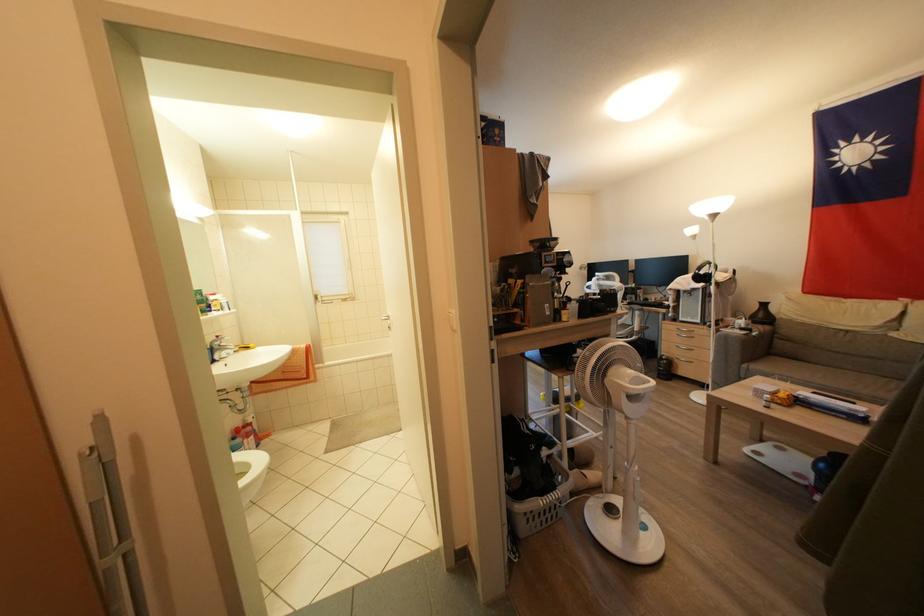
Find the location of a particular element. The width and height of the screenshot is (924, 616). shower door handle is located at coordinates (104, 516).